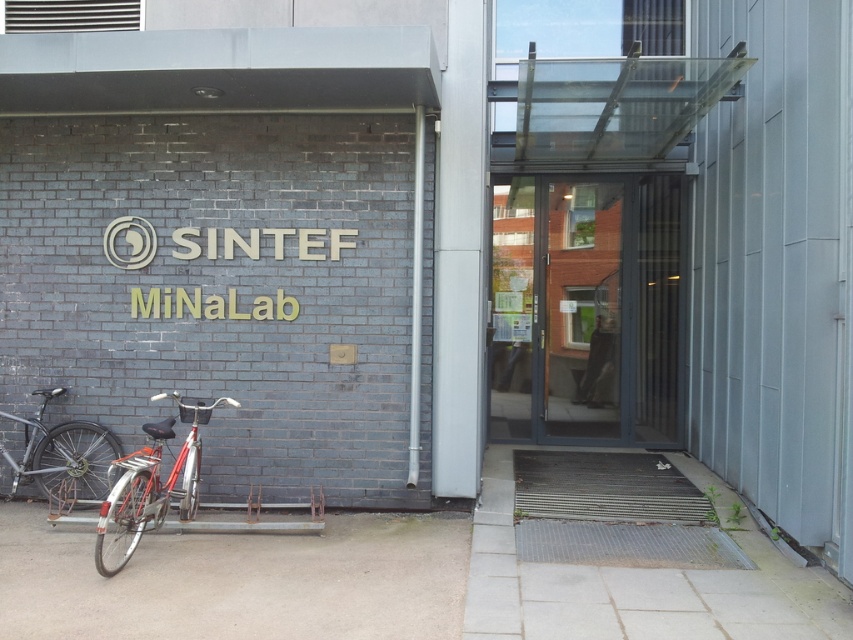
You are standing in front of the SINTEF MiNaLab entrance and want to walk from the metal rack to the glass canopy. Which point, point [634,252] or point [122,500], is closer to you as you start walking?

Point [634,252] is closer to you because it is further to the viewer than point [122,500], meaning it is nearer in your line of sight.

Based on the photo, you are a delivery person with a large box that is 1.2 meters wide. You need to enter the building through the transparent glass door at center. Can the shiny red bicycle at lower left parked nearby block your path? Please explain based on their widths.

The transparent glass door at center might be wider than shiny red bicycle at lower left. If the door is indeed wider, the bicycle would not block the path since it is narrower. However, if they are similar in width, the bicycle might obstruct passage. Measure the door and bicycle width to confirm.